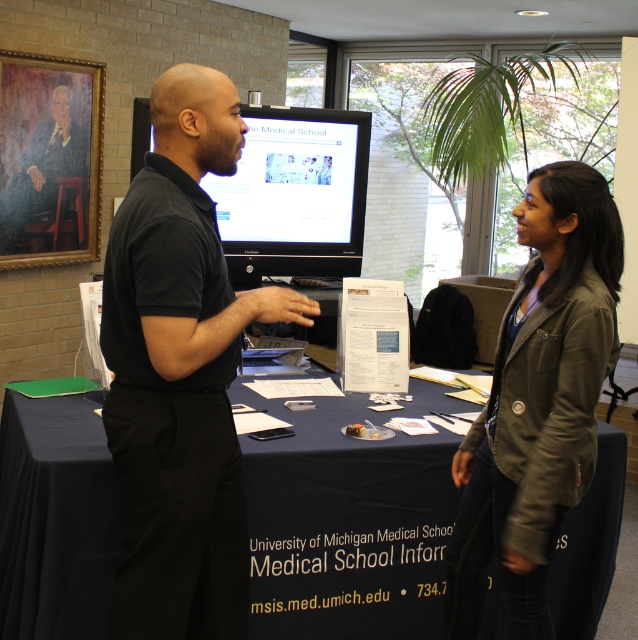
Who is shorter, black fabric table at center or matte black monitor at center?

With less height is matte black monitor at center.

Does black fabric table at center lie behind matte black monitor at center?

No, black fabric table at center is closer to the viewer.

Does point (309, 548) lie behind point (288, 166)?

No, (309, 548) is in front of (288, 166).

The height and width of the screenshot is (640, 638). I want to click on black fabric table at center, so click(x=345, y=525).

Is black fabric table at center smaller than black matte shirt at center?

Actually, black fabric table at center might be larger than black matte shirt at center.

Is black fabric table at center to the left of black matte shirt at center from the viewer's perspective?

Incorrect, black fabric table at center is not on the left side of black matte shirt at center.

The width and height of the screenshot is (638, 640). Identify the location of black fabric table at center. (345, 525).

Can you confirm if black matte shirt at center is positioned below leather jacket at center?

No, black matte shirt at center is not below leather jacket at center.

At what (x,y) coordinates should I click in order to perform the action: click on black matte shirt at center. Please return your answer as a coordinate pair (x, y). Looking at the image, I should click on (179, 372).